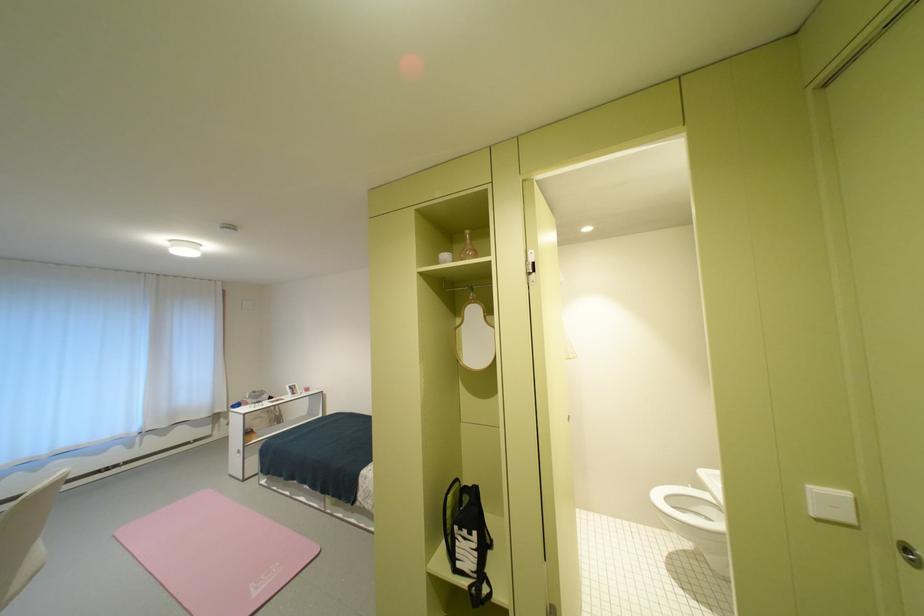
Describe the element at coordinates (687, 511) in the screenshot. I see `the toilet seat` at that location.